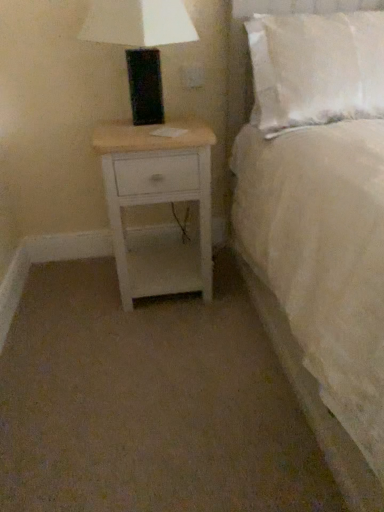
Find the location of a particular element. The width and height of the screenshot is (384, 512). free space on the front side of white wood nightstand at lower left is located at coordinates (168, 337).